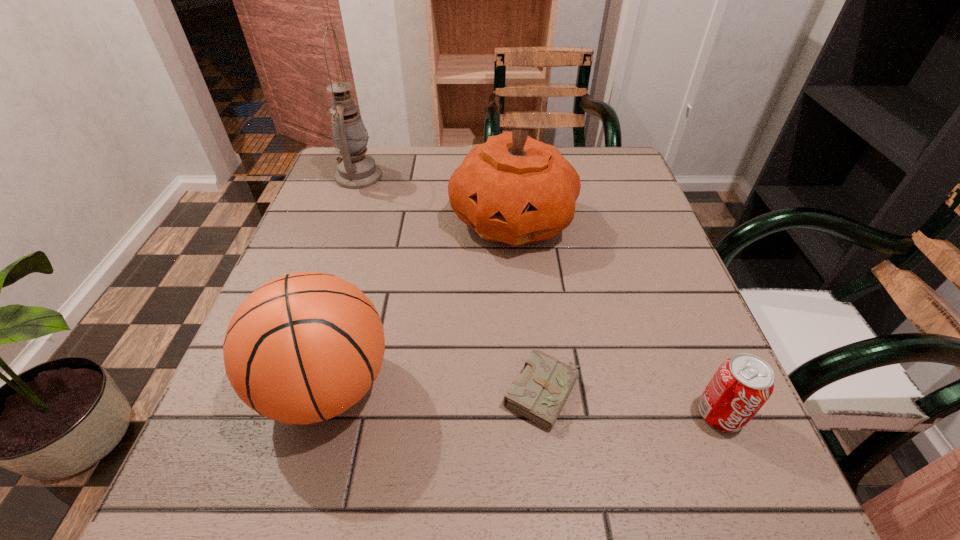
This screenshot has height=540, width=960. In order to click on free region located 0.170m on the left of the diary in this screenshot , I will do `click(396, 393)`.

At what (x,y) coordinates should I click in order to perform the action: click on oil lamp situated at the far edge. Please return your answer as a coordinate pair (x, y). This screenshot has height=540, width=960. Looking at the image, I should click on (356, 170).

Where is `pumpkin that is positioned at the far edge`? The width and height of the screenshot is (960, 540). pumpkin that is positioned at the far edge is located at coordinates (513, 189).

This screenshot has height=540, width=960. I want to click on oil lamp situated at the left edge, so click(x=356, y=170).

What are the coordinates of `basketball situated at the left edge` in the screenshot? It's located at point(304,347).

The height and width of the screenshot is (540, 960). What are the coordinates of `object at the right edge` in the screenshot? It's located at (742, 384).

This screenshot has height=540, width=960. In order to click on object that is positioned at the far left corner in this screenshot , I will do `click(356, 170)`.

In the image, there is a desktop. Where is `vacant space at the far edge`? The width and height of the screenshot is (960, 540). vacant space at the far edge is located at coordinates (408, 181).

Locate an element on the screen. This screenshot has height=540, width=960. vacant space at the near edge of the desktop is located at coordinates (401, 489).

You are a GUI agent. You are given a task and a screenshot of the screen. Output one action in this format:
    pyautogui.click(x=<x>, y=<y>)
    Task: Click on the free region at the left edge
    This screenshot has height=540, width=960.
    Given the screenshot: What is the action you would take?
    pyautogui.click(x=209, y=438)